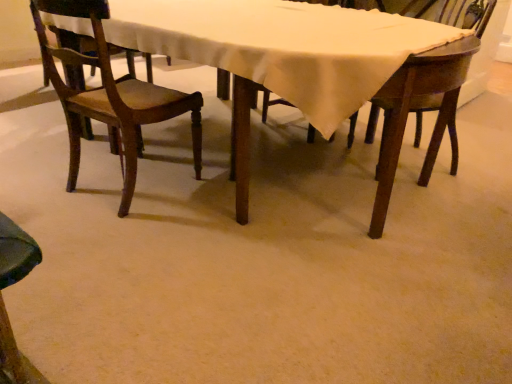
Question: Should I look upward or downward to see wooden chair at left, the 2th chair from the right?

Choices:
 (A) down
 (B) up

Answer: (B)

Question: Is wooden table at center with wooden chair at left, the 2th chair from the right?

Choices:
 (A) yes
 (B) no

Answer: (B)

Question: Can you confirm if wooden table at center is shorter than wooden chair at left, the 2th chair from the right?

Choices:
 (A) no
 (B) yes

Answer: (B)

Question: Does wooden table at center have a greater height compared to wooden chair at left, the 2th chair from the right?

Choices:
 (A) no
 (B) yes

Answer: (A)

Question: Can you confirm if wooden table at center is wider than wooden chair at left, the 2th chair from the right?

Choices:
 (A) yes
 (B) no

Answer: (A)

Question: Considering the relative sizes of wooden table at center and wooden chair at left, the 2th chair from the right, in the image provided, is wooden table at center thinner than wooden chair at left, the 2th chair from the right,?

Choices:
 (A) no
 (B) yes

Answer: (A)

Question: Is wooden table at center in front of wooden chair at left, which is counted as the first chair, starting from the left?

Choices:
 (A) no
 (B) yes

Answer: (B)

Question: From a real-world perspective, is wooden chair at upper right, placed as the first chair when sorted from right to left, on wooden table at center?

Choices:
 (A) no
 (B) yes

Answer: (B)

Question: Is wooden table at center completely or partially inside wooden chair at upper right, positioned as the 2th chair in left-to-right order?

Choices:
 (A) yes
 (B) no

Answer: (B)

Question: Does wooden chair at upper right, positioned as the 2th chair in left-to-right order, have a lesser height compared to wooden table at center?

Choices:
 (A) yes
 (B) no

Answer: (B)

Question: Is wooden chair at upper right, positioned as the 2th chair in left-to-right order, next to wooden table at center?

Choices:
 (A) no
 (B) yes

Answer: (A)

Question: Does wooden chair at upper right, positioned as the 2th chair in left-to-right order, come behind wooden table at center?

Choices:
 (A) no
 (B) yes

Answer: (B)

Question: Considering the relative sizes of wooden chair at upper right, positioned as the 2th chair in left-to-right order, and wooden table at center in the image provided, is wooden chair at upper right, positioned as the 2th chair in left-to-right order, smaller than wooden table at center?

Choices:
 (A) yes
 (B) no

Answer: (A)

Question: Could you tell me if wooden chair at upper right, positioned as the 2th chair in left-to-right order, is facing wooden chair at left, which is counted as the first chair, starting from the left?

Choices:
 (A) no
 (B) yes

Answer: (B)